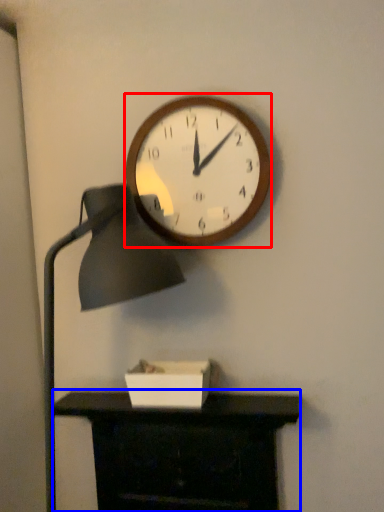
Question: Which object appears farthest to the camera in this image, wall clock (highlighted by a red box) or furniture (highlighted by a blue box)?

Choices:
 (A) wall clock
 (B) furniture

Answer: (A)